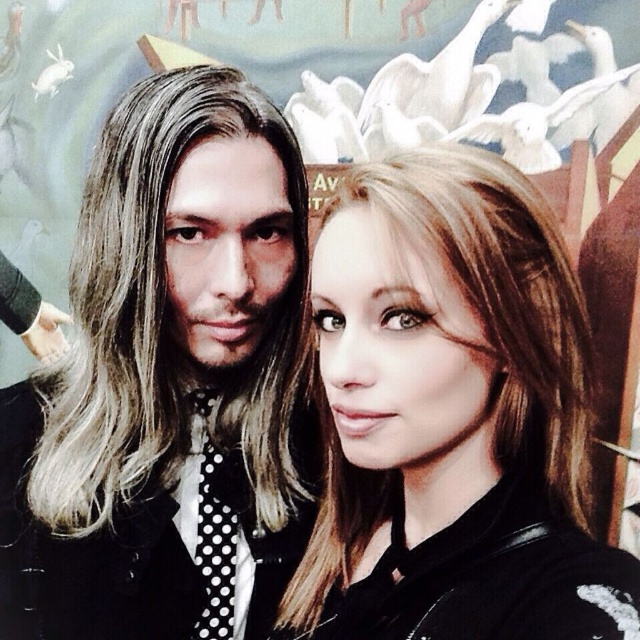
Question: Among these points, which one is farthest from the camera?

Choices:
 (A) (198, 556)
 (B) (177, 257)

Answer: (A)

Question: Is polka dot tie at center wider than black dotted fabric tie at left?

Choices:
 (A) yes
 (B) no

Answer: (A)

Question: Which point appears closest to the camera in this image?

Choices:
 (A) (195, 413)
 (B) (138, 90)

Answer: (B)

Question: Is brown hair at center wider than black dotted fabric tie at left?

Choices:
 (A) yes
 (B) no

Answer: (A)

Question: Which point is farther from the camera taking this photo?

Choices:
 (A) (x=202, y=472)
 (B) (x=460, y=152)

Answer: (A)

Question: Considering the relative positions of polka dot tie at center and brown hair at center in the image provided, where is polka dot tie at center located with respect to brown hair at center?

Choices:
 (A) below
 (B) above

Answer: (B)